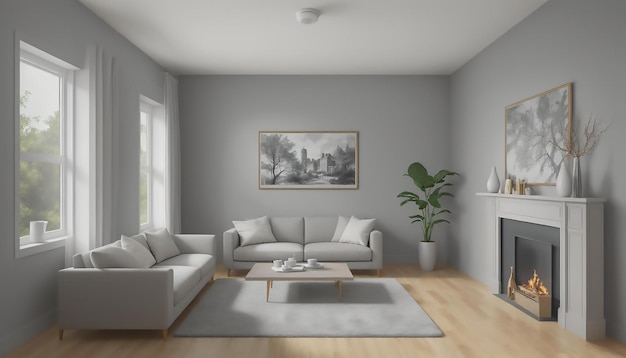
What are the coordinates of `cup` in the screenshot? It's located at (314, 262).